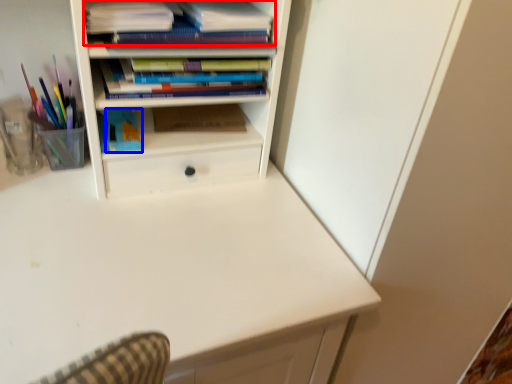
Question: Which point is further to the camera, book (highlighted by a red box) or paperback book (highlighted by a blue box)?

Choices:
 (A) book
 (B) paperback book

Answer: (B)